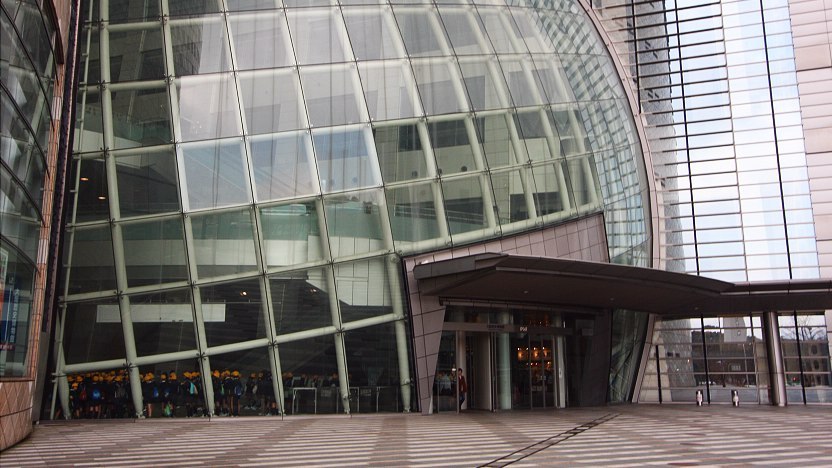
In order to click on glass windows in this screenshot , I will do `click(690, 362)`, `click(690, 338)`, `click(730, 352)`, `click(735, 368)`.